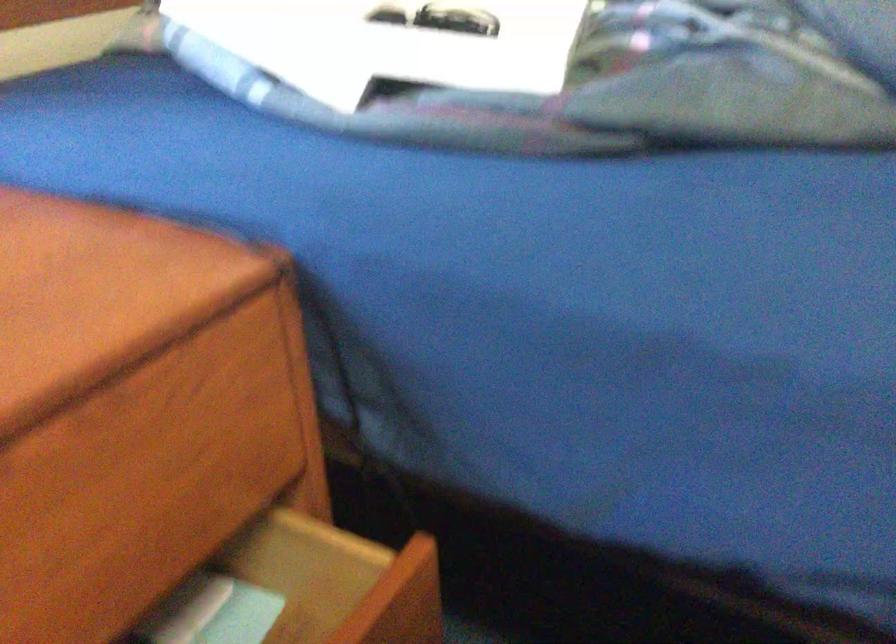
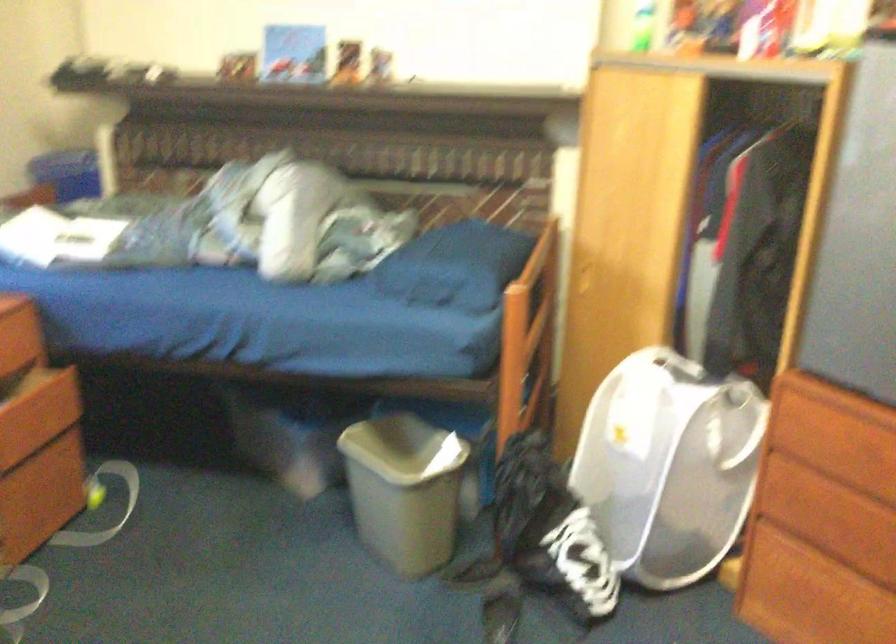
Question: The images are taken continuously from a first-person perspective. In which direction are you moving?

Choices:
 (A) Left
 (B) Right
 (C) Forward
 (D) Backward

Answer: (D)